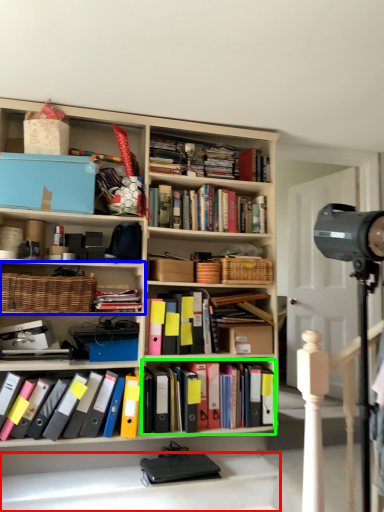
Question: Which object is positioned farthest from stairwell (highlighted by a red box)? Select from shelf (highlighted by a blue box) and book (highlighted by a green box).

Choices:
 (A) shelf
 (B) book

Answer: (A)